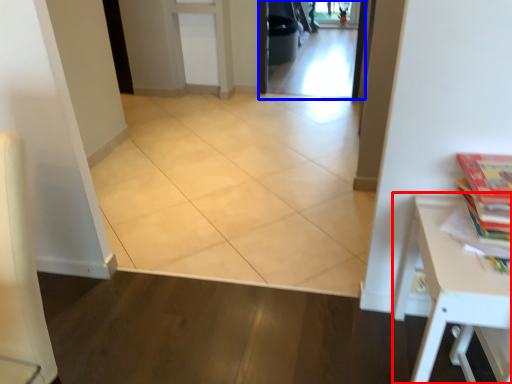
Question: Among these objects, which one is nearest to the camera, table (highlighted by a red box) or screen door (highlighted by a blue box)?

Choices:
 (A) table
 (B) screen door

Answer: (A)